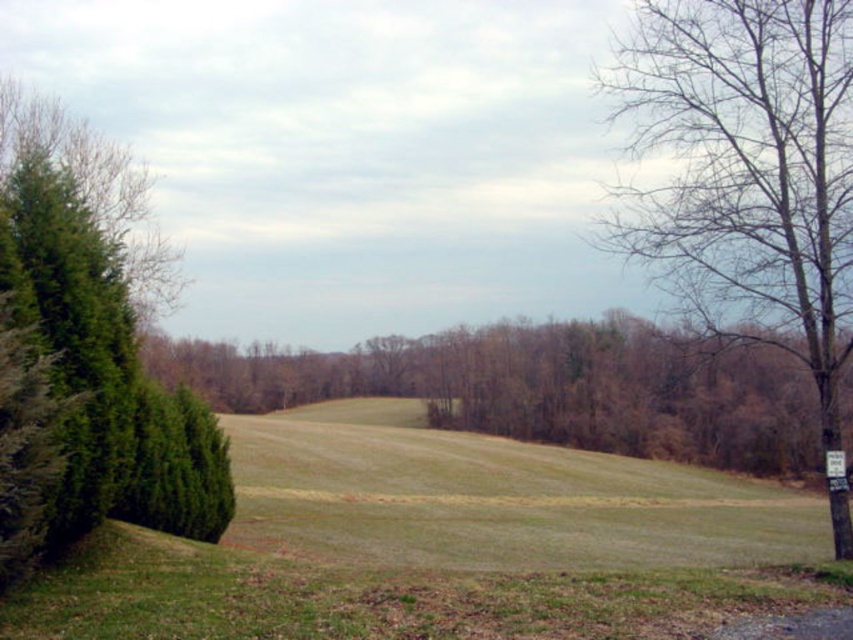
Consider the image. Can you confirm if green grassy field at center is positioned above bare wood tree at right?

Incorrect, green grassy field at center is not positioned above bare wood tree at right.

This screenshot has height=640, width=853. What do you see at coordinates (437, 544) in the screenshot?
I see `green grassy field at center` at bounding box center [437, 544].

Between point (328, 573) and point (792, 307), which one is positioned in front?

Positioned in front is point (328, 573).

Identify the location of green grassy field at center. This screenshot has width=853, height=640. (437, 544).

Consider the image. Between green grassy field at center and green textured hedge at left, which one is positioned lower?

green grassy field at center is lower down.

Who is shorter, green grassy field at center or green textured hedge at left?

green grassy field at center is shorter.

Does point (711, 520) come in front of point (190, 416)?

No.

Find the location of a particular element. green grassy field at center is located at coordinates (437, 544).

The width and height of the screenshot is (853, 640). Describe the element at coordinates (437, 544) in the screenshot. I see `green grassy field at center` at that location.

Who is lower down, green grassy field at center or green leafy tree at center?

green grassy field at center

Is point (662, 566) farther from viewer compared to point (506, 401)?

That is False.

You are a GUI agent. You are given a task and a screenshot of the screen. Output one action in this format:
    pyautogui.click(x=<x>, y=<y>)
    Task: Click on the green grassy field at center
    Image resolution: width=853 pixels, height=640 pixels.
    Given the screenshot: What is the action you would take?
    pyautogui.click(x=437, y=544)